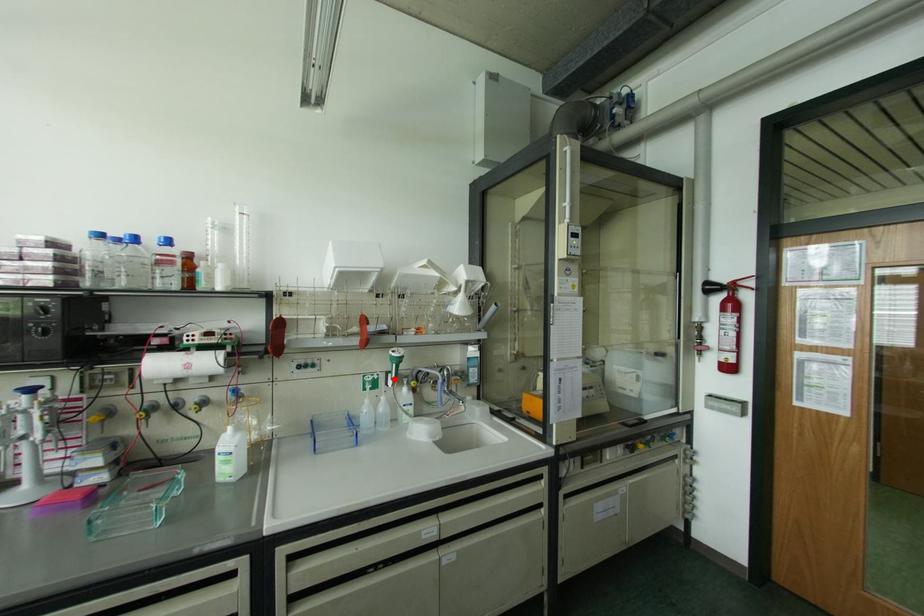
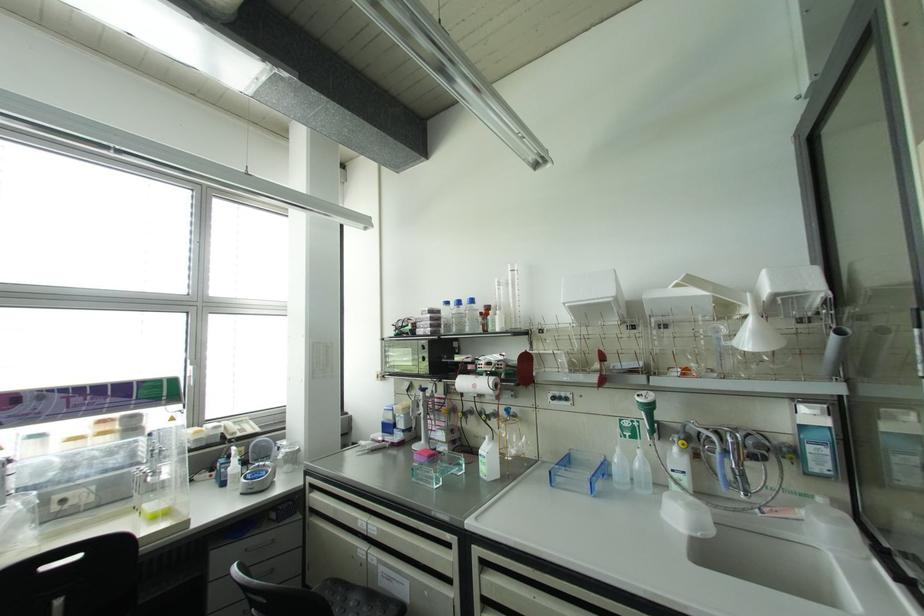
Locate, in the second image, the point that corresponds to the highlighted location in the first image.

(650, 432)